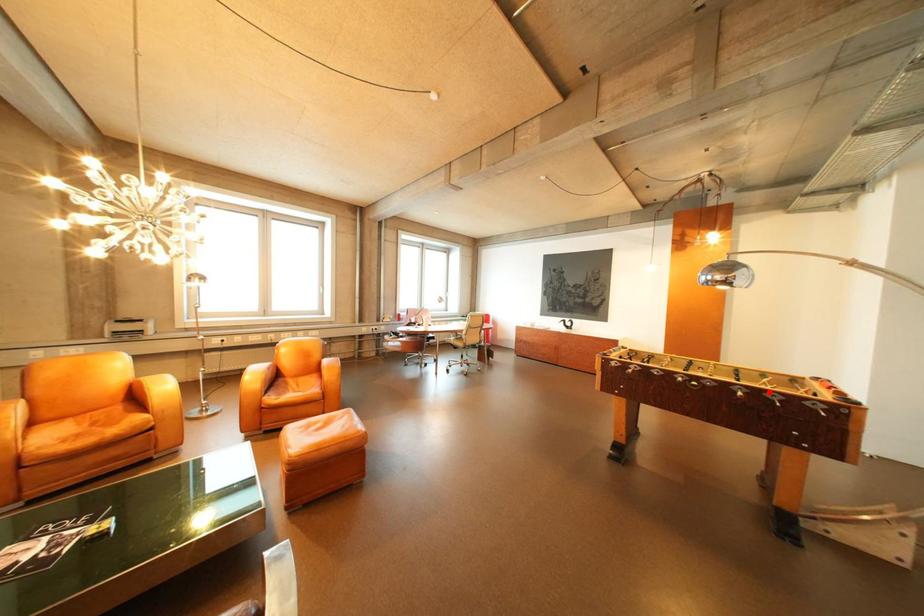
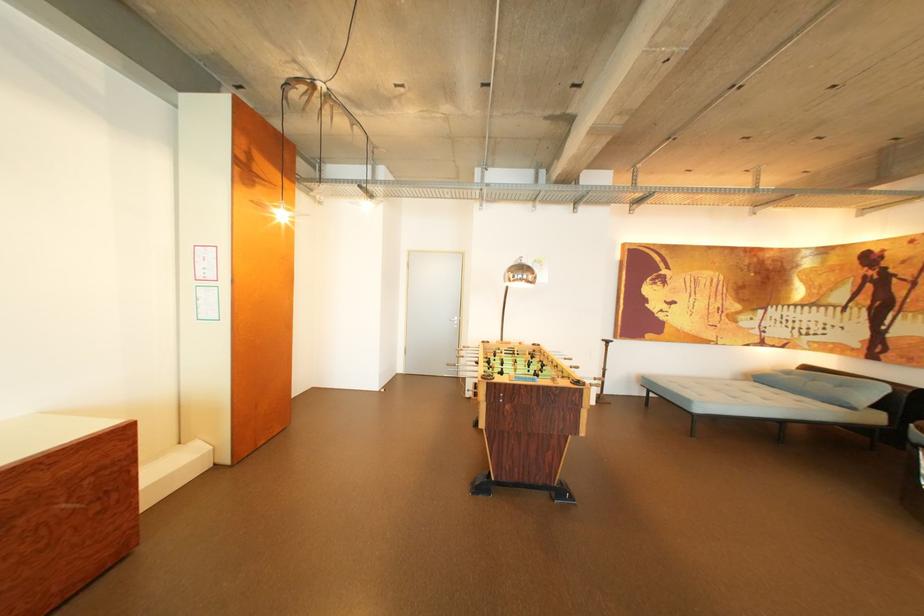
In the second image, find the point that corresponds to the highlighted location in the first image.

(562, 357)